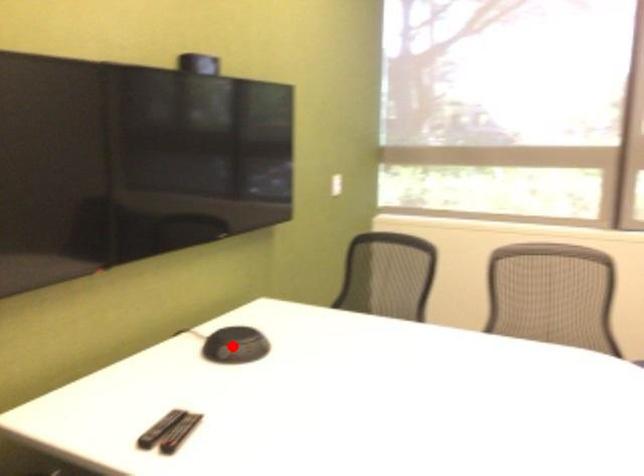
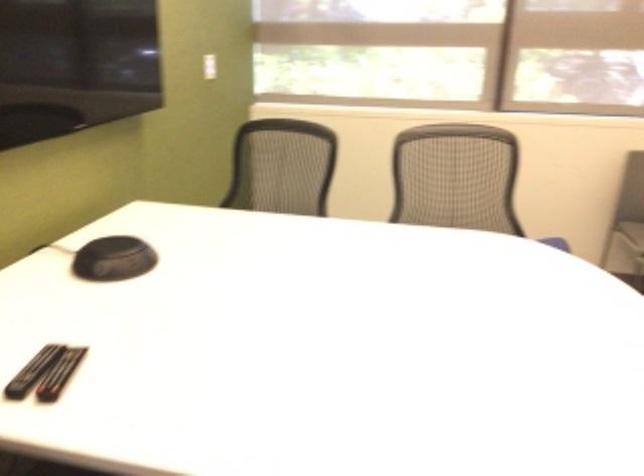
Question: I am providing you with two images of the same scene from different viewpoints. In image1, a red point is highlighted. Considering the same 3D point in image2, which of the following is correct?

Choices:
 (A) It is closer
 (B) It is farther

Answer: (A)